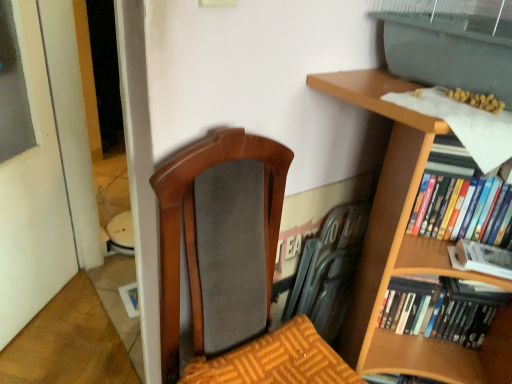
This screenshot has width=512, height=384. What do you see at coordinates (445, 189) in the screenshot?
I see `hardcover books at right, which is the third book in bottom-to-top order` at bounding box center [445, 189].

Describe the element at coordinates (443, 309) in the screenshot. I see `hardcover books at right, acting as the first book starting from the bottom` at that location.

The image size is (512, 384). Find the location of `matte black swivel chair at center`. matte black swivel chair at center is located at coordinates (329, 270).

Describe the element at coordinates (329, 270) in the screenshot. This screenshot has height=384, width=512. I see `matte black swivel chair at center` at that location.

What are the coordinates of `white matte book at right, positioned as the second book in top-to-bottom order` in the screenshot? It's located at (481, 258).

Considering the sizes of objects white matte book at right, the second book ordered from the bottom, and hardcover books at right, which is the third book in bottom-to-top order, in the image provided, who is wider, white matte book at right, the second book ordered from the bottom, or hardcover books at right, which is the third book in bottom-to-top order,?

With larger width is hardcover books at right, which is the third book in bottom-to-top order.

From the picture: Is hardcover books at right, positioned as the first book in top-to-bottom order, at the back of white matte book at right, positioned as the second book in top-to-bottom order?

No, white matte book at right, positioned as the second book in top-to-bottom order, is not facing away from hardcover books at right, positioned as the first book in top-to-bottom order.

Is the position of white matte book at right, positioned as the second book in top-to-bottom order, more distant than that of hardcover books at right, which is the third book in bottom-to-top order?

No, white matte book at right, positioned as the second book in top-to-bottom order, is closer to the viewer.

Looking at this image, from a real-world perspective, which is physically above, white matte book at right, the second book ordered from the bottom, or hardcover books at right, positioned as the first book in top-to-bottom order?

From a 3D spatial view, hardcover books at right, positioned as the first book in top-to-bottom order, is above.

From their relative heights in the image, would you say hardcover books at right, positioned as the first book in top-to-bottom order, is taller or shorter than hardcover books at right, marked as the third book in a top-to-bottom arrangement?

hardcover books at right, positioned as the first book in top-to-bottom order, is shorter than hardcover books at right, marked as the third book in a top-to-bottom arrangement.

Does hardcover books at right, which is the third book in bottom-to-top order, turn towards hardcover books at right, acting as the first book starting from the bottom?

No.

From the image's perspective, which book is the 2nd one above the hardcover books at right, acting as the first book starting from the bottom? Please provide its 2D coordinates.

[(445, 189)]

Can you confirm if hardcover books at right, which is the third book in bottom-to-top order, is positioned to the right of hardcover books at right, marked as the third book in a top-to-bottom arrangement?

Yes.

From the picture: Considering the sizes of objects white matte book at right, the second book ordered from the bottom, and hardcover books at right, acting as the first book starting from the bottom, in the image provided, who is bigger, white matte book at right, the second book ordered from the bottom, or hardcover books at right, acting as the first book starting from the bottom,?

Bigger between the two is hardcover books at right, acting as the first book starting from the bottom.

Is white matte book at right, positioned as the second book in top-to-bottom order, facing towards hardcover books at right, acting as the first book starting from the bottom?

No, white matte book at right, positioned as the second book in top-to-bottom order, does not turn towards hardcover books at right, acting as the first book starting from the bottom.

Based on the photo, from the image's perspective, between white matte book at right, the second book ordered from the bottom, and hardcover books at right, marked as the third book in a top-to-bottom arrangement, who is located below?

hardcover books at right, marked as the third book in a top-to-bottom arrangement.

From a real-world perspective, is white matte book at right, positioned as the second book in top-to-bottom order, on hardcover books at right, marked as the third book in a top-to-bottom arrangement?

Indeed, from a real-world perspective, white matte book at right, positioned as the second book in top-to-bottom order, stands above hardcover books at right, marked as the third book in a top-to-bottom arrangement.

In the image, is matte black swivel chair at center on the left side or the right side of hardcover books at right, marked as the third book in a top-to-bottom arrangement?

Based on their positions, matte black swivel chair at center is located to the left of hardcover books at right, marked as the third book in a top-to-bottom arrangement.

How distant is matte black swivel chair at center from hardcover books at right, marked as the third book in a top-to-bottom arrangement?

matte black swivel chair at center is 9.75 inches away from hardcover books at right, marked as the third book in a top-to-bottom arrangement.

Is the depth of matte black swivel chair at center less than that of hardcover books at right, acting as the first book starting from the bottom?

No, it is not.

Can you confirm if matte black swivel chair at center is smaller than hardcover books at right, acting as the first book starting from the bottom?

Yes, matte black swivel chair at center is smaller than hardcover books at right, acting as the first book starting from the bottom.

Is matte black swivel chair at center not inside hardcover books at right, which is the third book in bottom-to-top order?

Indeed, matte black swivel chair at center is completely outside hardcover books at right, which is the third book in bottom-to-top order.

Is matte black swivel chair at center oriented towards hardcover books at right, which is the third book in bottom-to-top order?

Yes, matte black swivel chair at center faces towards hardcover books at right, which is the third book in bottom-to-top order.

How different are the orientations of matte black swivel chair at center and hardcover books at right, which is the third book in bottom-to-top order, in degrees?

45.7 degrees.

From a real-world perspective, between matte black swivel chair at center and hardcover books at right, which is the third book in bottom-to-top order, who is vertically lower?

From a 3D spatial view, matte black swivel chair at center is below.

From a real-world perspective, is white matte book at right, positioned as the second book in top-to-bottom order, above or below matte black swivel chair at center?

Clearly, from a real-world perspective, white matte book at right, positioned as the second book in top-to-bottom order, is above matte black swivel chair at center.

Consider the image. Is white matte book at right, positioned as the second book in top-to-bottom order, to the right of matte black swivel chair at center from the viewer's perspective?

Yes, white matte book at right, positioned as the second book in top-to-bottom order, is to the right of matte black swivel chair at center.

Are white matte book at right, the second book ordered from the bottom, and matte black swivel chair at center beside each other?

No, white matte book at right, the second book ordered from the bottom, is not touching matte black swivel chair at center.

Considering the sizes of objects white matte book at right, the second book ordered from the bottom, and matte black swivel chair at center in the image provided, who is smaller, white matte book at right, the second book ordered from the bottom, or matte black swivel chair at center?

With smaller size is white matte book at right, the second book ordered from the bottom.

Between hardcover books at right, marked as the third book in a top-to-bottom arrangement, and hardcover books at right, positioned as the first book in top-to-bottom order, which one has less height?

hardcover books at right, positioned as the first book in top-to-bottom order, is shorter.

Is hardcover books at right, marked as the third book in a top-to-bottom arrangement, to the left of hardcover books at right, positioned as the first book in top-to-bottom order, from the viewer's perspective?

Correct, you'll find hardcover books at right, marked as the third book in a top-to-bottom arrangement, to the left of hardcover books at right, positioned as the first book in top-to-bottom order.

From the image's perspective, is hardcover books at right, acting as the first book starting from the bottom, located above or below hardcover books at right, positioned as the first book in top-to-bottom order?

Clearly, from the image's perspective, hardcover books at right, acting as the first book starting from the bottom, is below hardcover books at right, positioned as the first book in top-to-bottom order.

From the picture: Between hardcover books at right, acting as the first book starting from the bottom, and hardcover books at right, positioned as the first book in top-to-bottom order, which one has smaller width?

hardcover books at right, positioned as the first book in top-to-bottom order, is thinner.

This screenshot has width=512, height=384. I want to click on the 1st book below the hardcover books at right, positioned as the first book in top-to-bottom order (from the image's perspective), so click(481, 258).

Where is `book on the left of hardcover books at right, which is the third book in bottom-to-top order`? book on the left of hardcover books at right, which is the third book in bottom-to-top order is located at coordinates (443, 309).

Estimate the real-world distances between objects in this image. Which object is closer to white matte book at right, the second book ordered from the bottom, hardcover books at right, marked as the third book in a top-to-bottom arrangement, or hardcover books at right, which is the third book in bottom-to-top order?

The object closer to white matte book at right, the second book ordered from the bottom, is hardcover books at right, which is the third book in bottom-to-top order.

Consider the image. Based on their spatial positions, is hardcover books at right, marked as the third book in a top-to-bottom arrangement, or white matte book at right, the second book ordered from the bottom, further from matte black swivel chair at center?

The object further to matte black swivel chair at center is white matte book at right, the second book ordered from the bottom.

Which object lies further to the anchor point white matte book at right, the second book ordered from the bottom, hardcover books at right, which is the third book in bottom-to-top order, or matte black swivel chair at center?

matte black swivel chair at center.

Estimate the real-world distances between objects in this image. Which object is closer to hardcover books at right, marked as the third book in a top-to-bottom arrangement, white matte book at right, the second book ordered from the bottom, or hardcover books at right, positioned as the first book in top-to-bottom order?

The object closer to hardcover books at right, marked as the third book in a top-to-bottom arrangement, is white matte book at right, the second book ordered from the bottom.

Looking at the image, which one is located closer to white matte book at right, the second book ordered from the bottom, hardcover books at right, which is the third book in bottom-to-top order, or hardcover books at right, marked as the third book in a top-to-bottom arrangement?

Among the two, hardcover books at right, which is the third book in bottom-to-top order, is located nearer to white matte book at right, the second book ordered from the bottom.

Estimate the real-world distances between objects in this image. Which object is closer to hardcover books at right, positioned as the first book in top-to-bottom order, white matte book at right, positioned as the second book in top-to-bottom order, or hardcover books at right, marked as the third book in a top-to-bottom arrangement?

white matte book at right, positioned as the second book in top-to-bottom order, is closer to hardcover books at right, positioned as the first book in top-to-bottom order.

Which object lies nearer to the anchor point hardcover books at right, acting as the first book starting from the bottom, matte black swivel chair at center or white matte book at right, the second book ordered from the bottom?

The object closer to hardcover books at right, acting as the first book starting from the bottom, is white matte book at right, the second book ordered from the bottom.

Which object lies further to the anchor point matte black swivel chair at center, hardcover books at right, which is the third book in bottom-to-top order, or hardcover books at right, acting as the first book starting from the bottom?

Based on the image, hardcover books at right, which is the third book in bottom-to-top order, appears to be further to matte black swivel chair at center.

Where is `book between matte black swivel chair at center and hardcover books at right, which is the third book in bottom-to-top order, in the horizontal direction`? book between matte black swivel chair at center and hardcover books at right, which is the third book in bottom-to-top order, in the horizontal direction is located at coordinates (x=443, y=309).

Where is `book between hardcover books at right, which is the third book in bottom-to-top order, and hardcover books at right, acting as the first book starting from the bottom, from top to bottom`? book between hardcover books at right, which is the third book in bottom-to-top order, and hardcover books at right, acting as the first book starting from the bottom, from top to bottom is located at coordinates (481, 258).